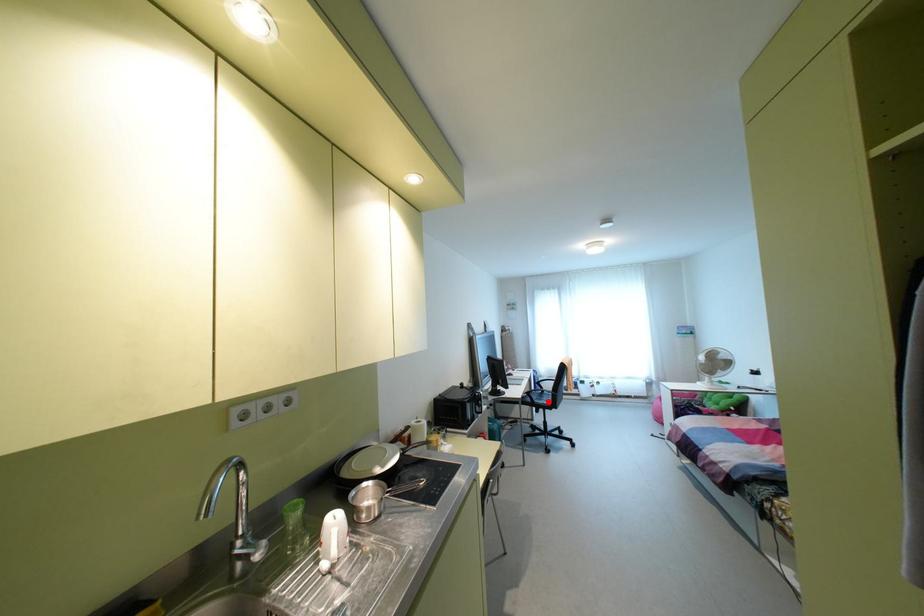
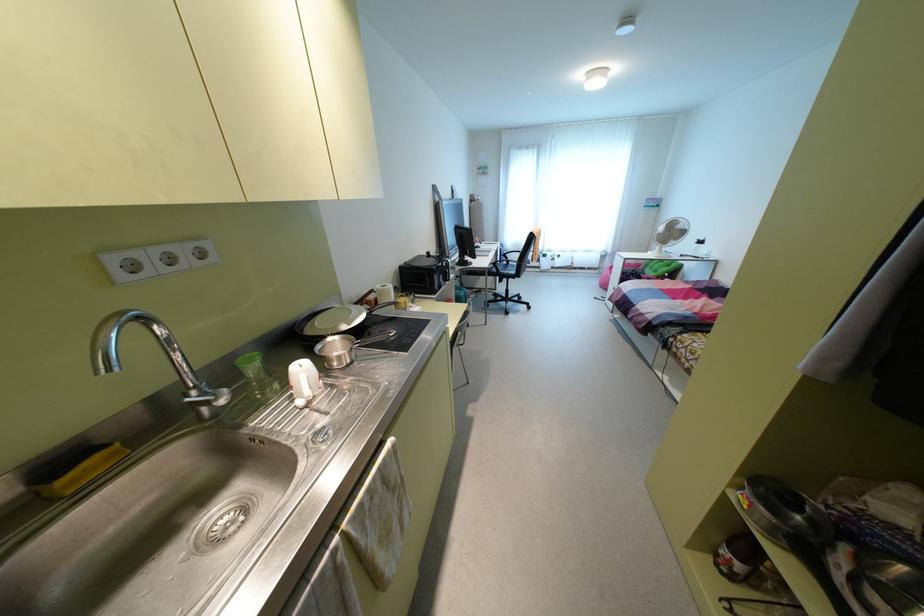
Question: I am providing you with two images of the same scene from different viewpoints. Given a red point in image1, look at the same physical point in image2. Is it:

Choices:
 (A) Closer to the viewpoint
 (B) Farther from the viewpoint

Answer: (A)